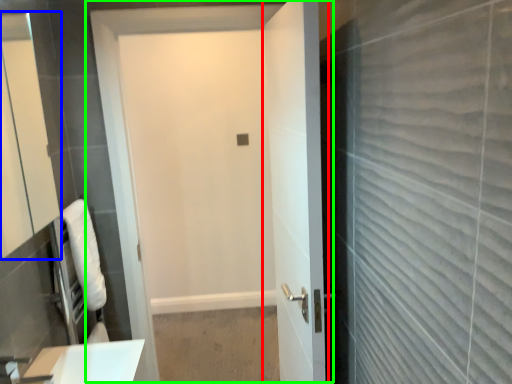
Question: Considering the real-world distances, which object is farthest from door (highlighted by a red box)? mirror (highlighted by a blue box) or door (highlighted by a green box)?

Choices:
 (A) mirror
 (B) door

Answer: (A)